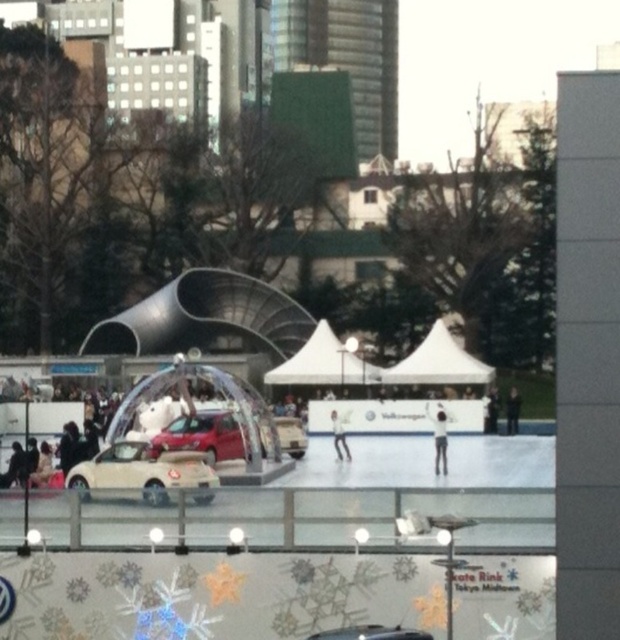
Does smooth white figure skater at center have a larger size compared to dark gray jacket at center?

No.

Between point (343, 444) and point (518, 416), which one is positioned in front?

Point (343, 444) is in front.

Which is behind, point (343, 432) or point (516, 417)?

The point (516, 417) is more distant.

In order to click on smooth white figure skater at center in this screenshot , I will do `click(339, 435)`.

How distant is matte silver car at center from smooth white figure skater at center?

31.46 meters

Is point (355, 625) positioned in front of point (337, 428)?

Yes, point (355, 625) is closer to viewer.

Image resolution: width=620 pixels, height=640 pixels. I want to click on matte silver car at center, so click(370, 632).

Can you confirm if beige matte car at center is taller than matte red car at center?

Yes.

Can you confirm if beige matte car at center is bigger than matte red car at center?

Correct, beige matte car at center is larger in size than matte red car at center.

Measure the distance between point (99,465) and camera.

Point (99,465) is 59.56 meters away from camera.

Where is `beige matte car at center`? The height and width of the screenshot is (640, 620). beige matte car at center is located at coordinates (143, 472).